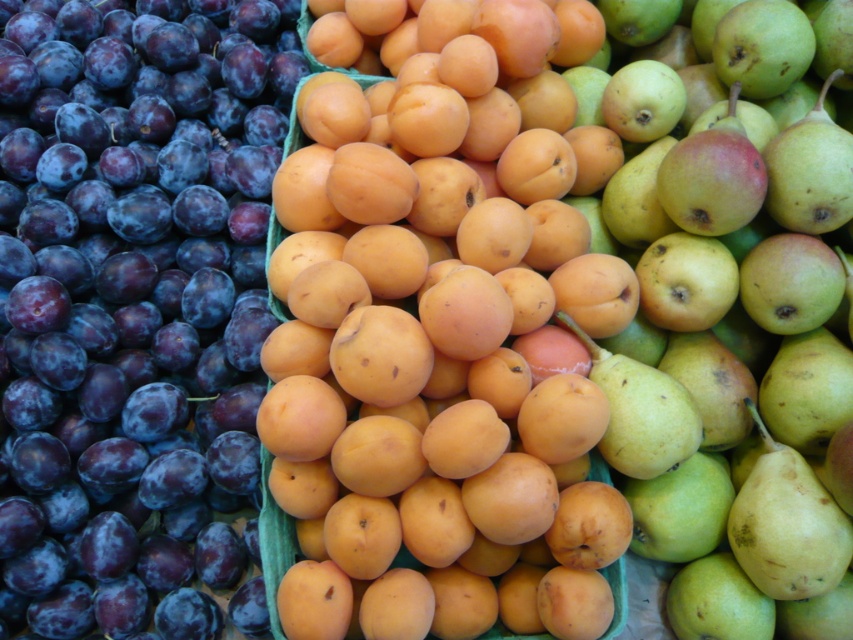
Question: Among these objects, which one is nearest to the camera?

Choices:
 (A) green matte pear at center
 (B) orange matte apricot at center
 (C) shiny dark purple plum at left

Answer: (B)

Question: Can you confirm if orange matte apricot at center is positioned below shiny dark purple plum at left?

Choices:
 (A) no
 (B) yes

Answer: (B)

Question: Can you confirm if orange matte apricot at center is bigger than shiny dark purple plum at left?

Choices:
 (A) yes
 (B) no

Answer: (B)

Question: Does shiny dark purple plum at left lie behind green matte pear at center?

Choices:
 (A) no
 (B) yes

Answer: (B)

Question: Which point appears farthest from the camera in this image?

Choices:
 (A) (572, 532)
 (B) (296, 67)

Answer: (B)

Question: Which object is positioned farthest from the green matte pear at center?

Choices:
 (A) shiny dark purple plum at left
 (B) orange matte apricot at center

Answer: (A)